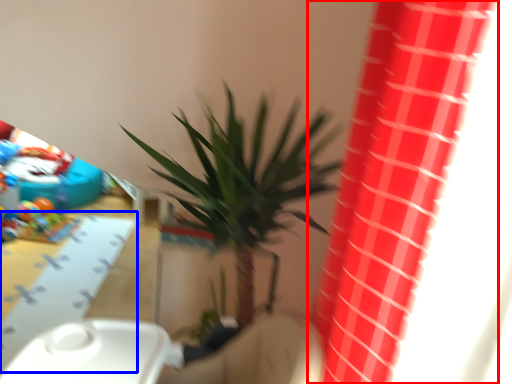
Question: Which point is closer to the camera, curtain (highlighted by a red box) or table (highlighted by a blue box)?

Choices:
 (A) curtain
 (B) table

Answer: (A)